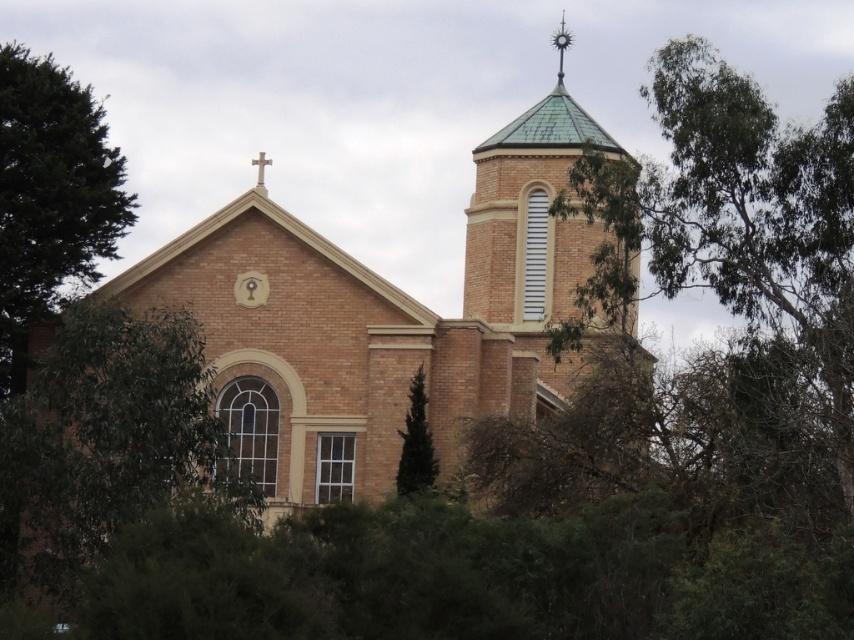
Who is positioned more to the left, green leafy tree at left or metallic spire at upper center?

green leafy tree at left is more to the left.

Is green leafy tree at left below metallic spire at upper center?

Yes, green leafy tree at left is below metallic spire at upper center.

The height and width of the screenshot is (640, 854). Describe the element at coordinates (50, 196) in the screenshot. I see `green leafy tree at left` at that location.

The image size is (854, 640). Find the location of `green leafy tree at left`. green leafy tree at left is located at coordinates (50, 196).

Is green leafy tree at lower left thinner than green coniferous tree at center?

No, green leafy tree at lower left is not thinner than green coniferous tree at center.

How distant is green leafy tree at lower left from green coniferous tree at center?

They are 24.13 meters apart.

You are a GUI agent. You are given a task and a screenshot of the screen. Output one action in this format:
    pyautogui.click(x=<x>, y=<y>)
    Task: Click on the green leafy tree at lower left
    
    Given the screenshot: What is the action you would take?
    pyautogui.click(x=107, y=445)

What do you see at coordinates (414, 442) in the screenshot? The height and width of the screenshot is (640, 854). I see `green coniferous tree at center` at bounding box center [414, 442].

Is green coniferous tree at center bigger than metallic spire at upper center?

Actually, green coniferous tree at center might be smaller than metallic spire at upper center.

Is point (431, 481) positioned before point (557, 83)?

Yes.

I want to click on green coniferous tree at center, so click(414, 442).